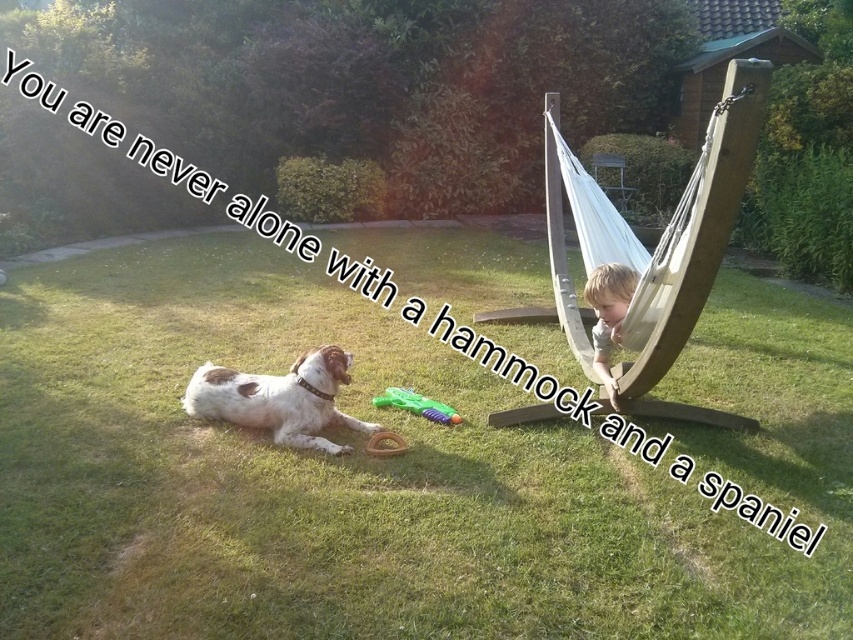
Question: Which point is closer to the camera?

Choices:
 (A) speckled fur dog at lower left
 (B) green plastic brush at lower center
 (C) green grass at lower left
 (D) light brown hair at hammock

Answer: (A)

Question: Which of the following is the closest to the observer?

Choices:
 (A) pos(374,401)
 (B) pos(305,404)
 (C) pos(613,320)
 (D) pos(590,483)

Answer: (D)

Question: Is speckled fur dog at lower left thinner than light brown hair at hammock?

Choices:
 (A) no
 (B) yes

Answer: (A)

Question: Is light brown hair at hammock to the left of green plastic brush at lower center from the viewer's perspective?

Choices:
 (A) yes
 (B) no

Answer: (B)

Question: Which is nearer to the green grass at lower left?

Choices:
 (A) speckled fur dog at lower left
 (B) light brown hair at hammock

Answer: (B)

Question: Is green grass at lower left bigger than green plastic brush at lower center?

Choices:
 (A) no
 (B) yes

Answer: (A)